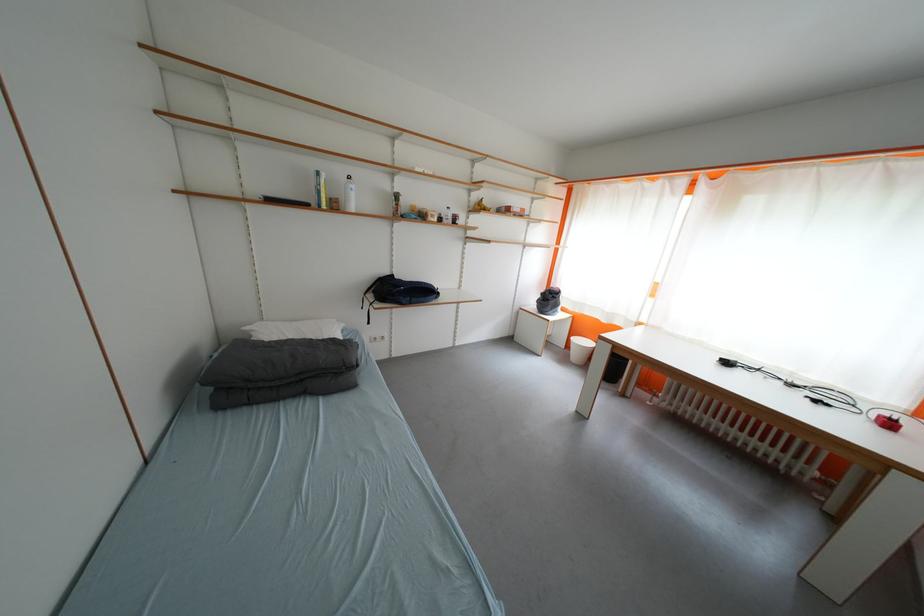
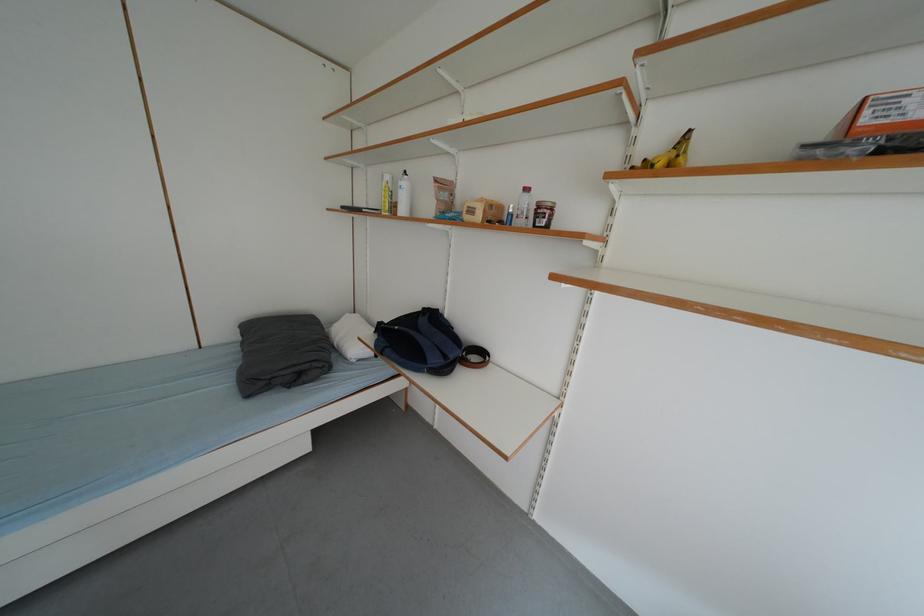
Find the pixel in the second image that matches the point at 444,223 in the first image.

(487, 220)